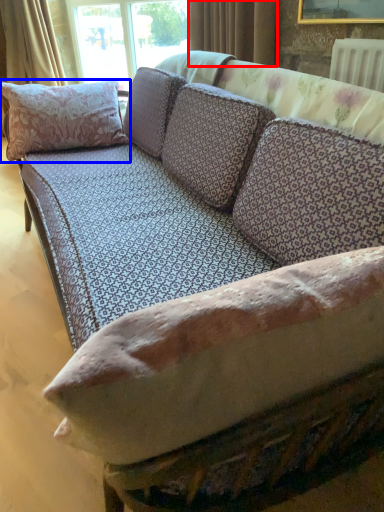
Question: Which object appears closest to the camera in this image, curtain (highlighted by a red box) or pillow (highlighted by a blue box)?

Choices:
 (A) curtain
 (B) pillow

Answer: (B)